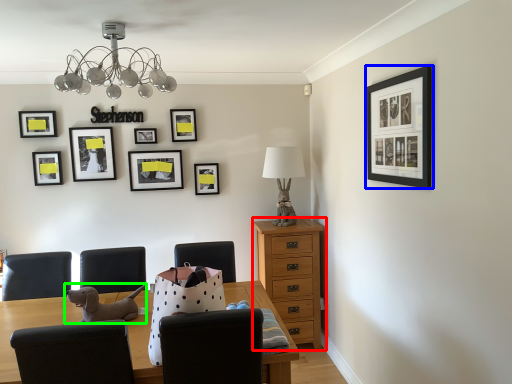
Question: Which is farther away from chest of drawers (highlighted by a red box)? picture frame (highlighted by a blue box) or animal (highlighted by a green box)?

Choices:
 (A) picture frame
 (B) animal

Answer: (B)